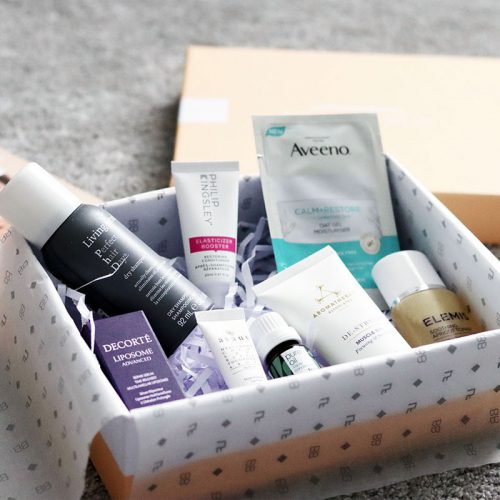
Find the location of `open bottom of gift box`. open bottom of gift box is located at coordinates (241, 443).